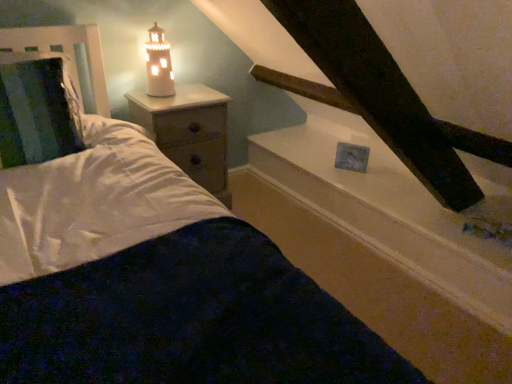
Identify the location of unoccupied area in front of white ceramic lighthouse at upper left. (158, 106).